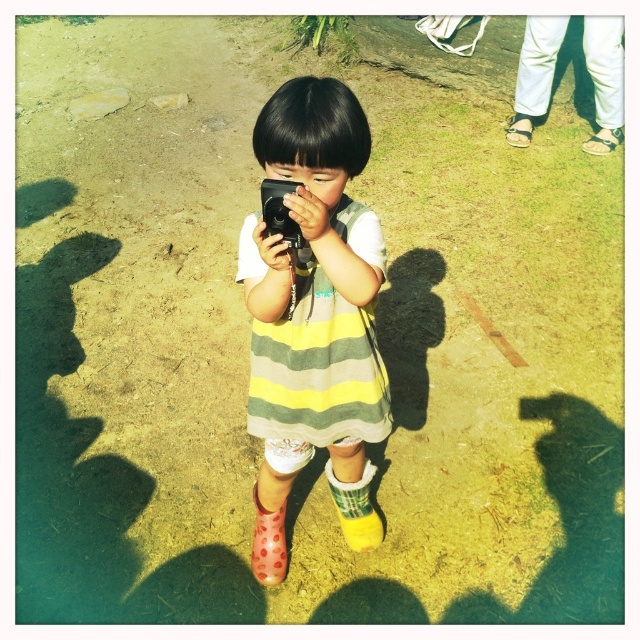
Can you confirm if yellow striped dress at center is bigger than black plastic camera at center?

Correct, yellow striped dress at center is larger in size than black plastic camera at center.

Identify the location of yellow striped dress at center. The width and height of the screenshot is (640, 640). (314, 316).

Which is in front, point (244, 220) or point (289, 244)?

Point (289, 244) is in front.

Locate an element on the screen. This screenshot has height=640, width=640. yellow striped dress at center is located at coordinates (314, 316).

Does yellow striped dress at center appear on the right side of white leather sandals at upper right?

In fact, yellow striped dress at center is to the left of white leather sandals at upper right.

Looking at this image, does yellow striped dress at center lie behind white leather sandals at upper right?

No, yellow striped dress at center is in front of white leather sandals at upper right.

Describe the element at coordinates (314, 316) in the screenshot. The width and height of the screenshot is (640, 640). I see `yellow striped dress at center` at that location.

You are a GUI agent. You are given a task and a screenshot of the screen. Output one action in this format:
    pyautogui.click(x=<x>, y=<y>)
    Task: Click on the yellow striped dress at center
    
    Given the screenshot: What is the action you would take?
    pyautogui.click(x=314, y=316)

Based on the photo, does white soft sock at lower center lie behind pink dotted rubber boot at lower left?

No, white soft sock at lower center is closer to the viewer.

Does white soft sock at lower center come in front of pink dotted rubber boot at lower left?

Yes, it is.

Locate an element on the screen. This screenshot has width=640, height=640. white soft sock at lower center is located at coordinates (356, 508).

The height and width of the screenshot is (640, 640). Find the location of `white soft sock at lower center`. white soft sock at lower center is located at coordinates (356, 508).